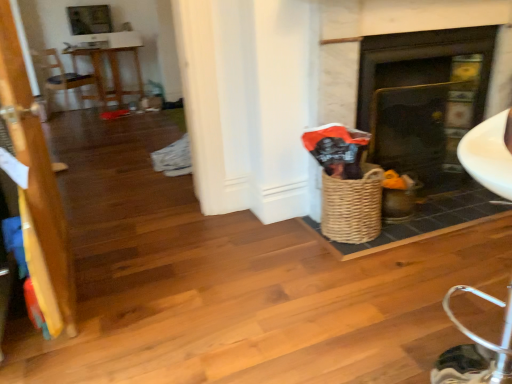
In order to click on vacant area that is situated to the right of wooden door at left in this screenshot , I will do `click(156, 283)`.